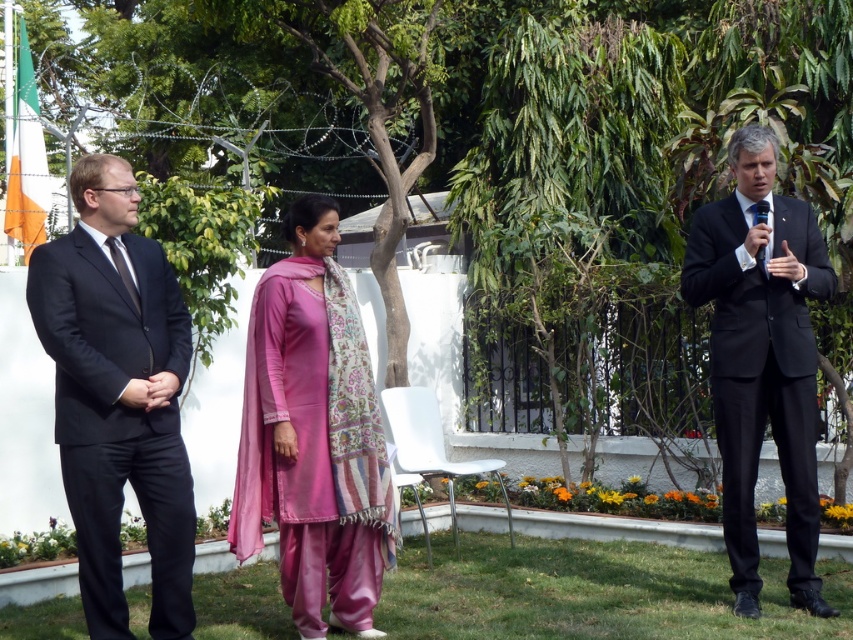
You are organizing a photo shoot and need to arrange the pink satin kurta at center and the matte black suit at right in a line from left to right. Based on their current positions, which should come first?

The pink satin kurta at center should come first since it is positioned on the left side of the matte black suit at right.

You are a photographer setting up for an event. You need to position a spotlight so that it illuminates both the matte black suit at left and the pink satin kurta at center. Given their positions, which direction should you aim the spotlight to ensure both are evenly lit?

The matte black suit at left is located above the pink satin kurta at center. To evenly illuminate both, aim the spotlight downward from above the matte black suit at left towards the pink satin kurta at center.